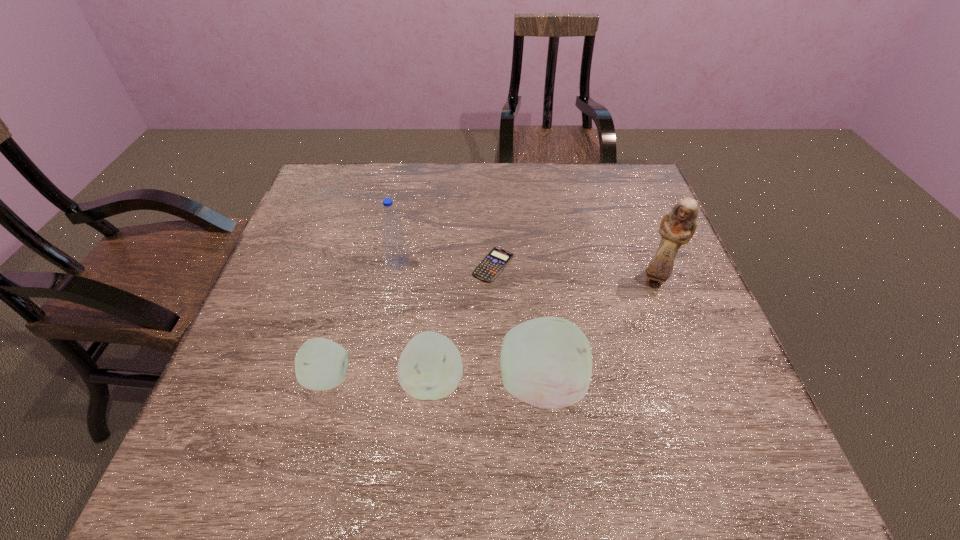
The height and width of the screenshot is (540, 960). I want to click on vacant space positioned on the back of the fourth tallest object, so click(x=445, y=241).

The width and height of the screenshot is (960, 540). Find the location of `vacant space positioned 0.070m on the left of the tallest apple`. vacant space positioned 0.070m on the left of the tallest apple is located at coordinates (464, 385).

The height and width of the screenshot is (540, 960). In order to click on vacant position located on the right of the fifth object from right to left in this screenshot , I will do `click(460, 262)`.

The image size is (960, 540). What are the coordinates of `vacant space located on the right of the calculator` in the screenshot? It's located at (609, 265).

At what (x,y) coordinates should I click in order to perform the action: click on free location located 0.330m on the front-facing side of the tallest object. Please return your answer as a coordinate pair (x, y). The width and height of the screenshot is (960, 540). Looking at the image, I should click on click(710, 424).

Locate an element on the screen. The height and width of the screenshot is (540, 960). object located at the right edge is located at coordinates (677, 227).

Locate an element on the screen. Image resolution: width=960 pixels, height=540 pixels. vacant space at the far edge of the desktop is located at coordinates click(528, 208).

This screenshot has width=960, height=540. Find the location of `free space at the left edge`. free space at the left edge is located at coordinates (275, 278).

Image resolution: width=960 pixels, height=540 pixels. What are the coordinates of `blank space at the right edge` in the screenshot? It's located at (678, 348).

I want to click on free space at the far left corner, so click(352, 165).